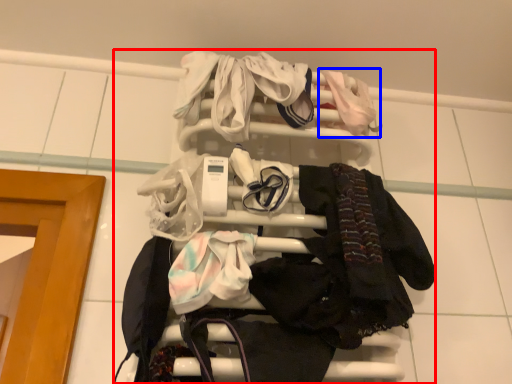
Question: Which object is closer to the camera taking this photo, bunk bed (highlighted by a red box) or baby clothe (highlighted by a blue box)?

Choices:
 (A) bunk bed
 (B) baby clothe

Answer: (A)